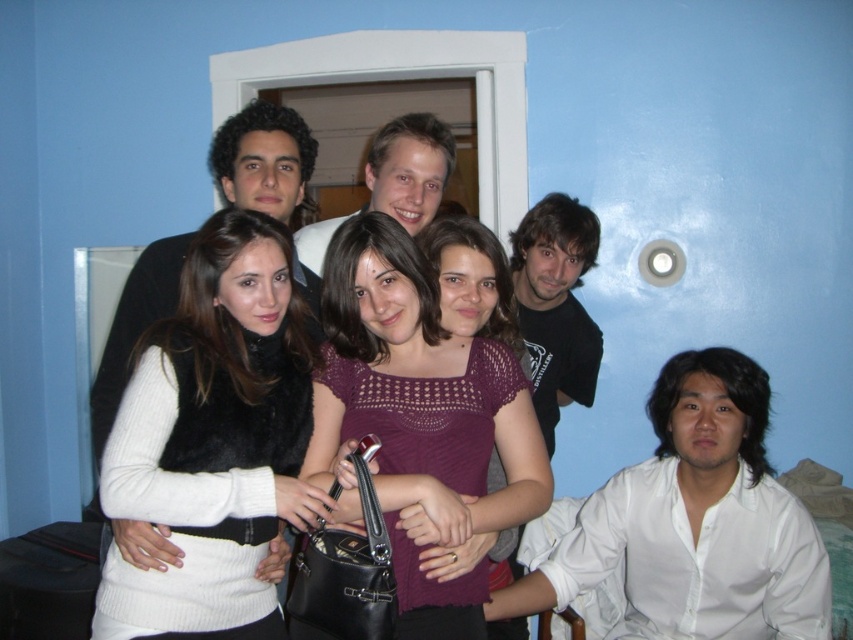
You are a photographer trying to capture a closeup of the white fuzzy vest at center and the dark brown hair at center. Given that your camera can only focus on one subject at a time, which subject should you choose to ensure the larger one is in focus?

The white fuzzy vest at center is bigger than dark brown hair at center, so you should focus on the white fuzzy vest at center to ensure the larger subject is in focus.

What are the coordinates of the purple knitted top at center?

The purple knitted top at center is located at coordinates point (x=427, y=403).

You are a photographer trying to adjust the lighting for a group photo. You notice the white fuzzy vest at center and dark brown hair at center. Which object is positioned lower in the image?

The white fuzzy vest at center is located below dark brown hair at center, so the white fuzzy vest at center is positioned lower in the image.